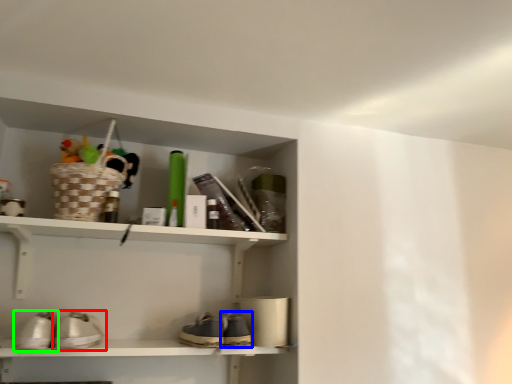
Question: Based on their relative distances, which object is farther from footwear (highlighted by a red box)? Choose from shoe (highlighted by a blue box) and footwear (highlighted by a green box).

Choices:
 (A) shoe
 (B) footwear

Answer: (A)